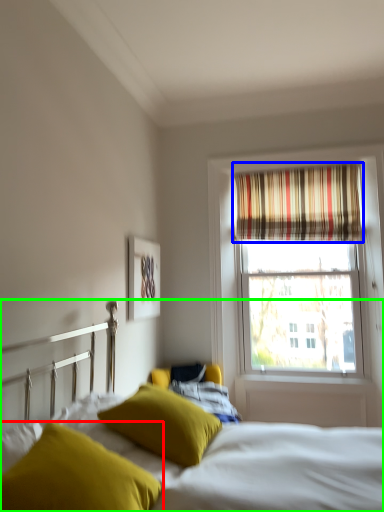
Question: Which is farther away from pillow (highlighted by a red box)? curtain (highlighted by a blue box) or bed (highlighted by a green box)?

Choices:
 (A) curtain
 (B) bed

Answer: (A)